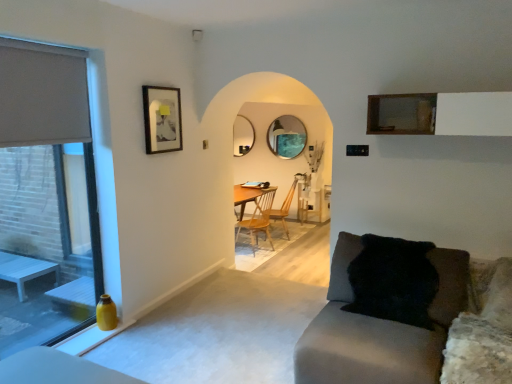
Question: Does velvet grey couch at lower right have a larger size compared to black fur pillow at lower right?

Choices:
 (A) no
 (B) yes

Answer: (B)

Question: Is velvet grey couch at lower right smaller than black fur pillow at lower right?

Choices:
 (A) yes
 (B) no

Answer: (B)

Question: From a real-world perspective, is velvet grey couch at lower right located higher than black fur pillow at lower right?

Choices:
 (A) yes
 (B) no

Answer: (B)

Question: Can you confirm if velvet grey couch at lower right is positioned to the right of black fur pillow at lower right?

Choices:
 (A) no
 (B) yes

Answer: (A)

Question: Are velvet grey couch at lower right and black fur pillow at lower right beside each other?

Choices:
 (A) yes
 (B) no

Answer: (B)

Question: From a real-world perspective, is velvet grey couch at lower right located beneath black fur pillow at lower right?

Choices:
 (A) yes
 (B) no

Answer: (A)

Question: Is matte black picture frame at upper left with wooden at center, acting as the 1th chair starting from the front?

Choices:
 (A) yes
 (B) no

Answer: (B)

Question: From a real-world perspective, is matte black picture frame at upper left physically above wooden at center, acting as the 1th chair starting from the front?

Choices:
 (A) no
 (B) yes

Answer: (B)

Question: Is matte black picture frame at upper left facing away from wooden at center, the second chair in the back-to-front sequence?

Choices:
 (A) yes
 (B) no

Answer: (B)

Question: From a real-world perspective, is matte black picture frame at upper left located beneath wooden at center, the second chair in the back-to-front sequence?

Choices:
 (A) no
 (B) yes

Answer: (A)

Question: Is matte black picture frame at upper left positioned beyond the bounds of wooden at center, the second chair in the back-to-front sequence?

Choices:
 (A) no
 (B) yes

Answer: (B)

Question: Is matte black picture frame at upper left bigger than wooden at center, acting as the 1th chair starting from the front?

Choices:
 (A) no
 (B) yes

Answer: (A)

Question: Is wooden at center, acting as the 1th chair starting from the front, closer to camera compared to matte glass window at left?

Choices:
 (A) no
 (B) yes

Answer: (A)